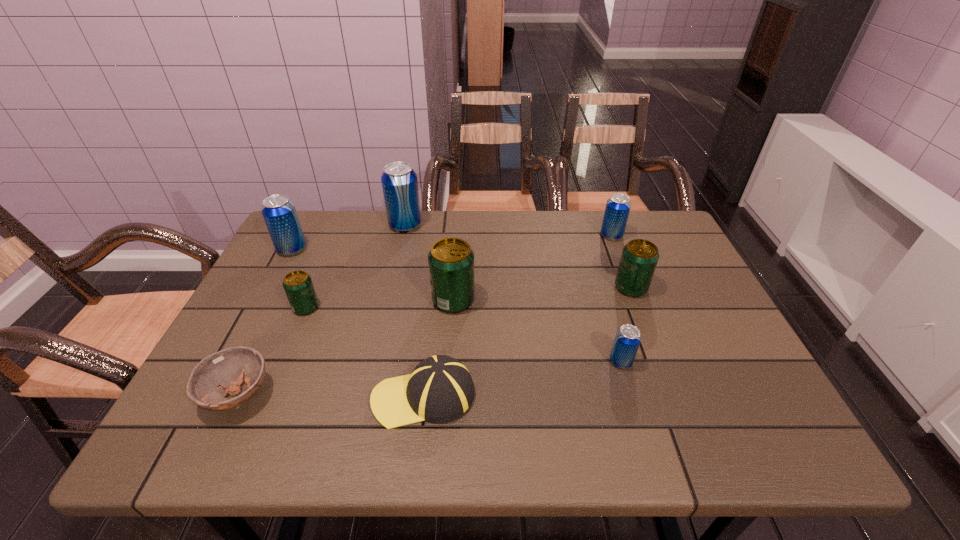
Find the location of a particular element. empty space that is in between the biggest blue beer can and the rightmost green beer can is located at coordinates (518, 256).

Image resolution: width=960 pixels, height=540 pixels. I want to click on unoccupied area between the tallest beer can and the leftmost blue beer can, so click(x=348, y=237).

Choose which object is the fourth nearest neighbor to the rightmost blue beer can. Please provide its 2D coordinates. Your answer should be formatted as a tuple, i.e. [(x, y)], where the tuple contains the x and y coordinates of a point satisfying the conditions above.

[(399, 182)]

Select which object is the seventh closest to the rightmost green beer can. Please provide its 2D coordinates. Your answer should be formatted as a tuple, i.e. [(x, y)], where the tuple contains the x and y coordinates of a point satisfying the conditions above.

[(221, 373)]

Where is `beer can that is the second closest to the leftmost green beer can`? beer can that is the second closest to the leftmost green beer can is located at coordinates (451, 260).

Select which beer can appears as the sixth closest to the bowl. Please provide its 2D coordinates. Your answer should be formatted as a tuple, i.e. [(x, y)], where the tuple contains the x and y coordinates of a point satisfying the conditions above.

[(639, 258)]

Locate an element on the screen. Image resolution: width=960 pixels, height=540 pixels. the second closest blue beer can to the smallest blue beer can is located at coordinates (399, 182).

Identify the location of blue beer can that is the second closest to the third biggest blue beer can. The height and width of the screenshot is (540, 960). (399, 182).

This screenshot has width=960, height=540. I want to click on green beer can that is the closest one to the second beer can from left to right, so click(451, 260).

Identify which green beer can is located as the second nearest to the second green beer can from left to right. Please provide its 2D coordinates. Your answer should be formatted as a tuple, i.e. [(x, y)], where the tuple contains the x and y coordinates of a point satisfying the conditions above.

[(639, 258)]